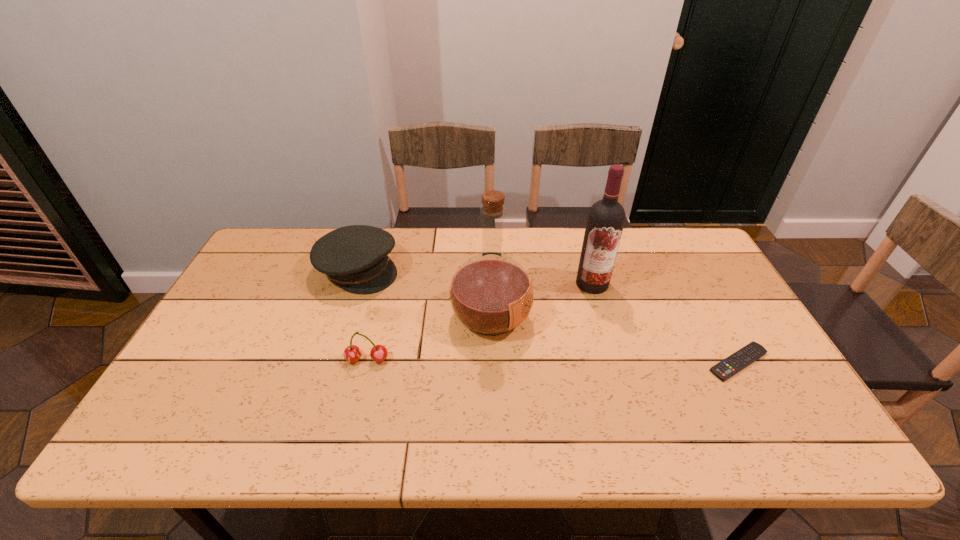
This screenshot has width=960, height=540. Identify the location of cherry. pos(352,353).

At what (x,y) coordinates should I click in order to perform the action: click on the rightmost object. Please return your answer as a coordinate pair (x, y). This screenshot has height=540, width=960. Looking at the image, I should click on (725, 369).

You are a GUI agent. You are given a task and a screenshot of the screen. Output one action in this format:
    pyautogui.click(x=<x>, y=<y>)
    Task: Click on the shortest object
    
    Given the screenshot: What is the action you would take?
    pyautogui.click(x=725, y=369)

This screenshot has height=540, width=960. What are the coordinates of `wine bottle` in the screenshot? It's located at (606, 217).

The width and height of the screenshot is (960, 540). Find the location of `beret`. beret is located at coordinates (355, 257).

This screenshot has width=960, height=540. Find the location of `the third object from right to left`. the third object from right to left is located at coordinates (491, 294).

Identify the location of free space located with stems pointing upwards on the cherry. (358, 398).

Image resolution: width=960 pixels, height=540 pixels. Find the location of `vacant space located on the left of the remote control`. vacant space located on the left of the remote control is located at coordinates (615, 362).

Locate an element on the screen. The width and height of the screenshot is (960, 540). vacant area situated on the label of the wine bottle is located at coordinates (566, 357).

This screenshot has height=540, width=960. Identify the location of vacant space positioned on the label of the wine bottle. (553, 396).